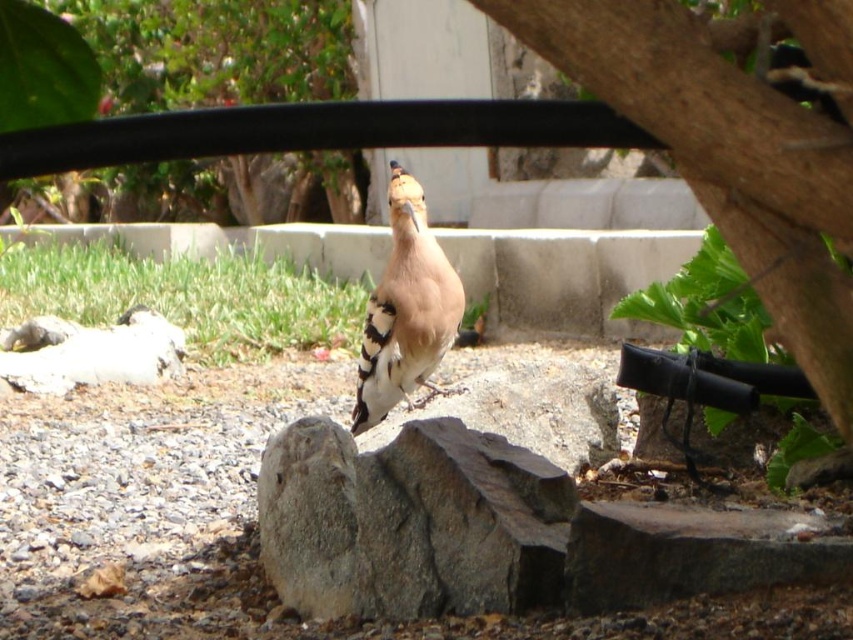
Who is positioned more to the left, brown rough bark at upper right or green leafy tree at upper center?

green leafy tree at upper center is more to the left.

Does brown rough bark at upper right have a greater height compared to green leafy tree at upper center?

No, brown rough bark at upper right is not taller than green leafy tree at upper center.

At what (x,y) coordinates should I click in order to perform the action: click on brown rough bark at upper right. Please return your answer as a coordinate pair (x, y). This screenshot has height=640, width=853. Looking at the image, I should click on (733, 147).

Which is more to the left, green leafy tree at upper center or brown speckled feathers at center?

green leafy tree at upper center is more to the left.

Who is lower down, green leafy tree at upper center or brown speckled feathers at center?

brown speckled feathers at center is below.

The width and height of the screenshot is (853, 640). Identify the location of green leafy tree at upper center. (215, 51).

Is brown rough bark at upper right bigger than gray rough rock at center?

Incorrect, brown rough bark at upper right is not larger than gray rough rock at center.

Can you confirm if brown rough bark at upper right is taller than gray rough rock at center?

In fact, brown rough bark at upper right may be shorter than gray rough rock at center.

Describe the element at coordinates (733, 147) in the screenshot. The width and height of the screenshot is (853, 640). I see `brown rough bark at upper right` at that location.

You are a GUI agent. You are given a task and a screenshot of the screen. Output one action in this format:
    pyautogui.click(x=<x>, y=<y>)
    Task: Click on the brown rough bark at upper right
    
    Given the screenshot: What is the action you would take?
    pyautogui.click(x=733, y=147)